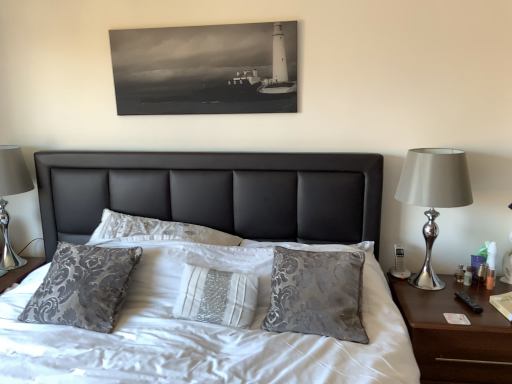
Question: From the image's perspective, is silver metallic lamp at right above or below silver metallic table lamp at left?

Choices:
 (A) below
 (B) above

Answer: (A)

Question: Based on their sizes in the image, would you say silver metallic lamp at right is bigger or smaller than silver metallic table lamp at left?

Choices:
 (A) big
 (B) small

Answer: (B)

Question: Which object is the closest to the silver metallic table lamp at left?

Choices:
 (A) brown wood nightstand at right
 (B) silver metallic lamp at right

Answer: (B)

Question: Which of these objects is positioned closest to the silver metallic lamp at right?

Choices:
 (A) silver metallic table lamp at left
 (B) brown wood nightstand at right

Answer: (B)